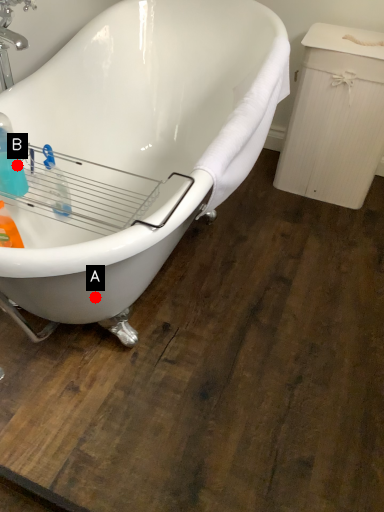
Question: Two points are circled on the image, labeled by A and B beside each circle. Which point is closer to the camera?

Choices:
 (A) A is closer
 (B) B is closer

Answer: (A)